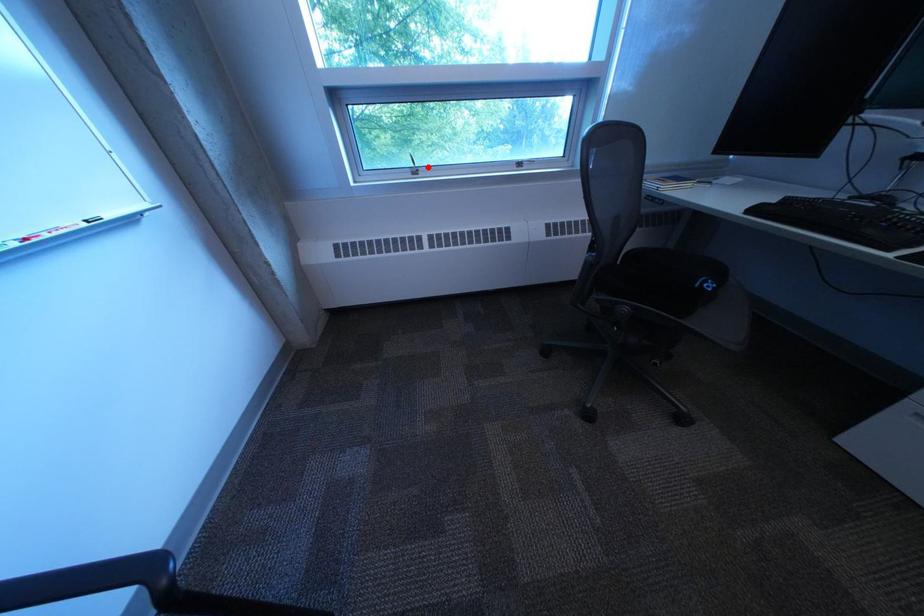
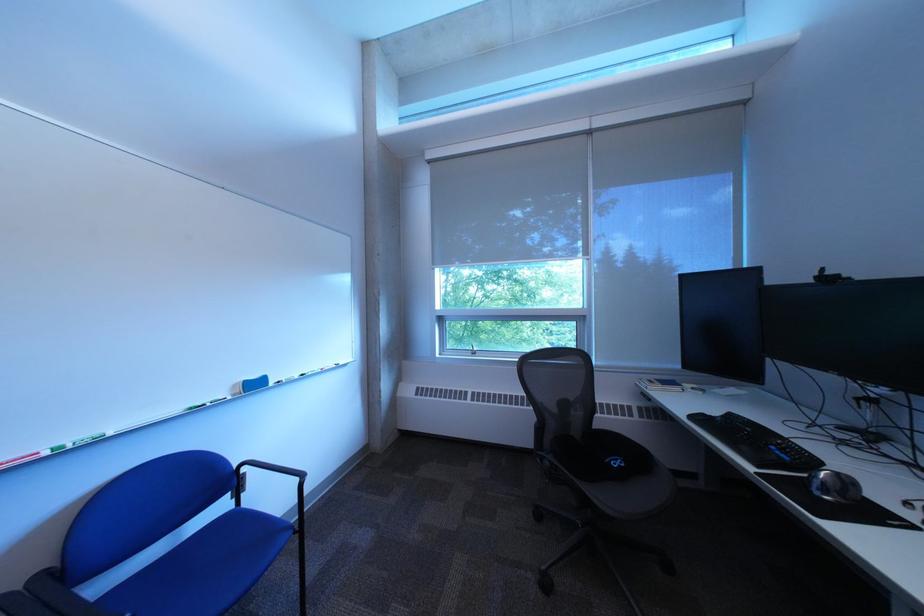
The point at the highlighted location is marked in the first image. Where is the corresponding point in the second image?

(488, 351)